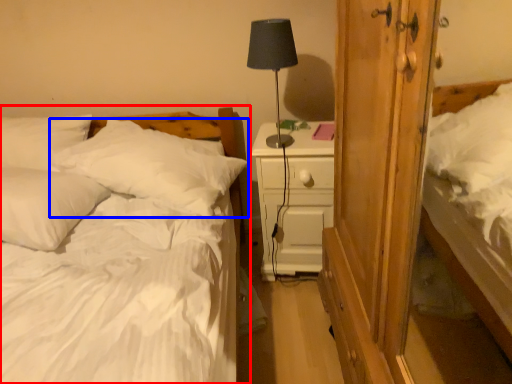
Question: Which object is further to the camera taking this photo, bed (highlighted by a red box) or pillow (highlighted by a blue box)?

Choices:
 (A) bed
 (B) pillow

Answer: (B)